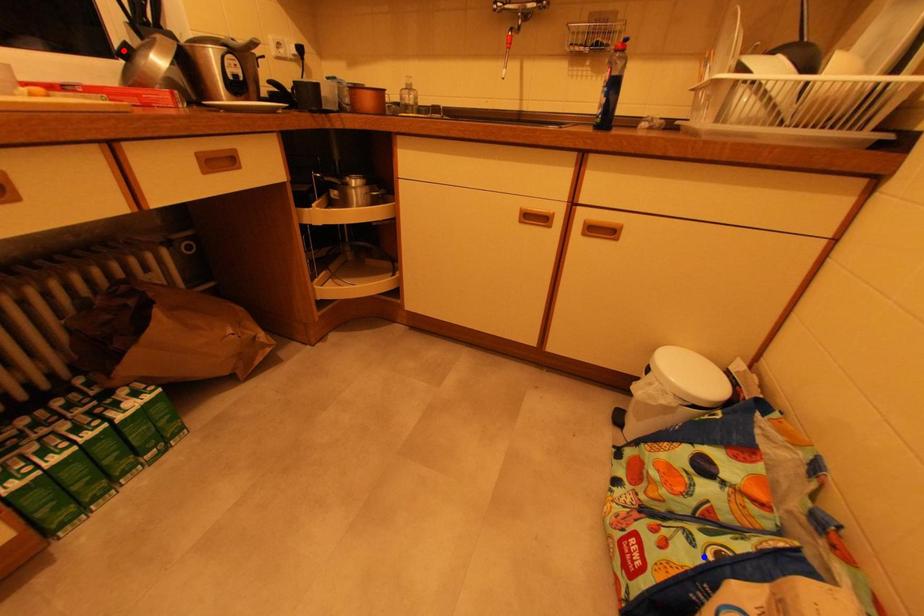
Question: Two points are marked on the image. Which point is closer to the camera?

Choices:
 (A) Blue point is closer.
 (B) Red point is closer.

Answer: (A)